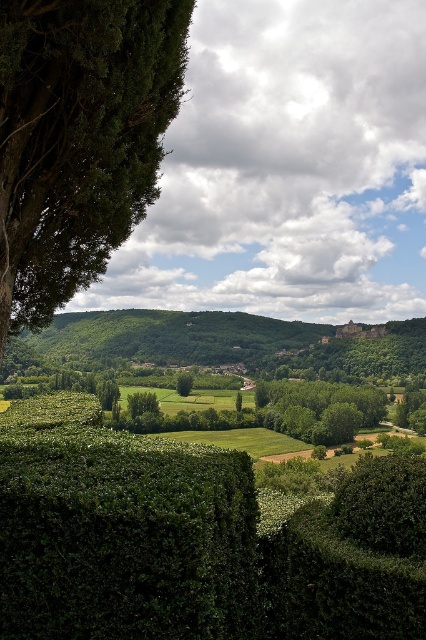
Question: Is green leafy hillside at center positioned before green leafy bush at center?

Choices:
 (A) no
 (B) yes

Answer: (B)

Question: Is green leafy hillside at center to the left of green leafy bush at center from the viewer's perspective?

Choices:
 (A) yes
 (B) no

Answer: (A)

Question: Among these points, which one is farthest from the camera?

Choices:
 (A) (213, 552)
 (B) (134, 17)
 (C) (39, 342)
 (D) (181, 387)

Answer: (C)

Question: Among these objects, which one is farthest from the camera?

Choices:
 (A) green leafy tree at center
 (B) green leafy hedge at center

Answer: (A)

Question: Which point is closer to the camera?

Choices:
 (A) (86, 84)
 (B) (181, 628)

Answer: (B)

Question: Is green leafy hedge at center positioned before green leafy tree at upper left?

Choices:
 (A) yes
 (B) no

Answer: (A)